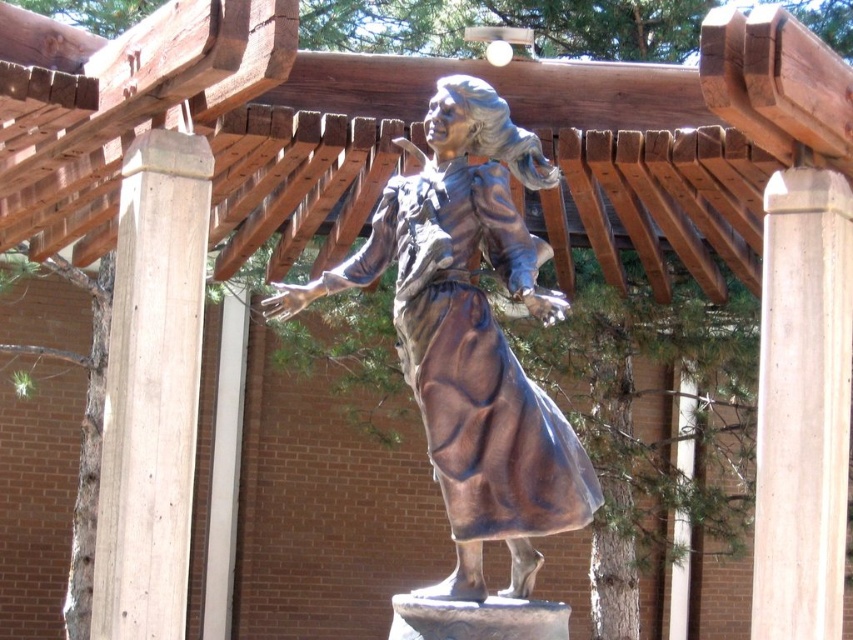
Who is positioned more to the left, bronze statue at center or smooth light brown wood at left?

Positioned to the left is smooth light brown wood at left.

Is bronze statue at center positioned before smooth light brown wood at left?

That is True.

Describe the element at coordinates (471, 336) in the screenshot. Image resolution: width=853 pixels, height=640 pixels. I see `bronze statue at center` at that location.

Locate an element on the screen. The width and height of the screenshot is (853, 640). bronze statue at center is located at coordinates (471, 336).

Can you confirm if smooth light brown wood at left is positioned below smooth concrete pillar at right?

No.

Between smooth light brown wood at left and smooth concrete pillar at right, which one has less height?

Standing shorter between the two is smooth concrete pillar at right.

Who is more distant from viewer, (x=161, y=534) or (x=781, y=273)?

The point (x=781, y=273) is more distant.

Where is `smooth light brown wood at left`? This screenshot has width=853, height=640. smooth light brown wood at left is located at coordinates (152, 388).

Between point (486, 440) and point (817, 324), which one is positioned in front?

Positioned in front is point (486, 440).

Which of these two, bronze statue at center or smooth concrete pillar at right, stands shorter?

With less height is bronze statue at center.

Is point (450, 237) closer to camera compared to point (804, 404)?

Yes, it is in front of point (804, 404).

Identify the location of bronze statue at center. Image resolution: width=853 pixels, height=640 pixels. (471, 336).